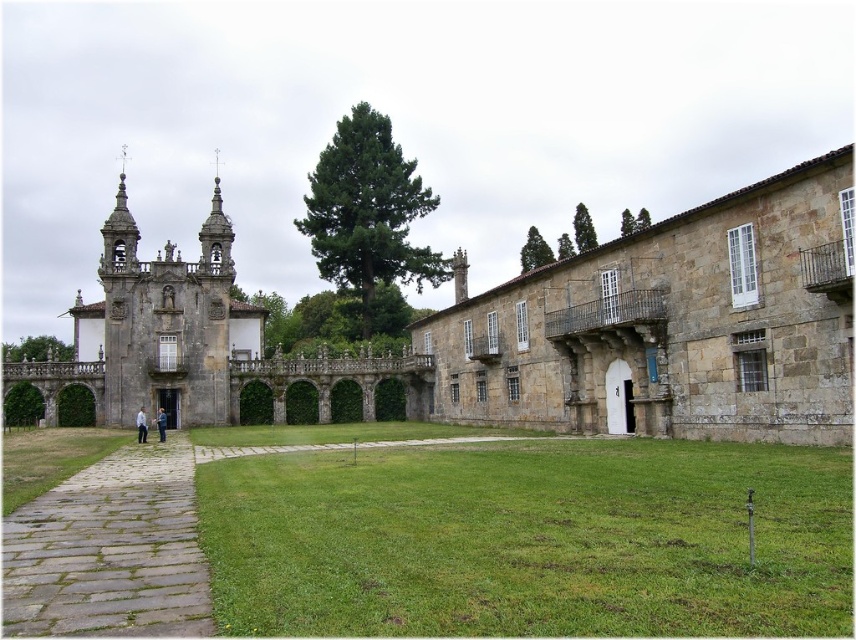
Who is shorter, gray stone path at lower left or white cotton shirt at center?

Standing shorter between the two is gray stone path at lower left.

Who is more forward, (87,474) or (137,420)?

Point (87,474) is more forward.

The image size is (856, 640). Find the location of `gray stone path at lower left`. gray stone path at lower left is located at coordinates (110, 552).

Is point (530, 340) closer to viewer compared to point (159, 440)?

Yes, point (530, 340) is in front of point (159, 440).

Is brown stone building at center taller than light blue fabric jacket at center?

Indeed, brown stone building at center has a greater height compared to light blue fabric jacket at center.

Does point (195, 400) lie behind point (163, 422)?

Yes, point (195, 400) is farther from viewer.

You are a GUI agent. You are given a task and a screenshot of the screen. Output one action in this format:
    pyautogui.click(x=<x>, y=<y>)
    Task: Click on the brown stone building at center
    
    Given the screenshot: What is the action you would take?
    pyautogui.click(x=535, y=330)

Is the position of gray stone path at lower left more distant than that of light blue fabric jacket at center?

No, gray stone path at lower left is closer to the viewer.

Is gray stone path at lower left in front of light blue fabric jacket at center?

Yes, it is in front of light blue fabric jacket at center.

At what (x,y) coordinates should I click in order to perform the action: click on gray stone path at lower left. Please return your answer as a coordinate pair (x, y). Looking at the image, I should click on (110, 552).

Locate an element on the screen. gray stone path at lower left is located at coordinates (110, 552).